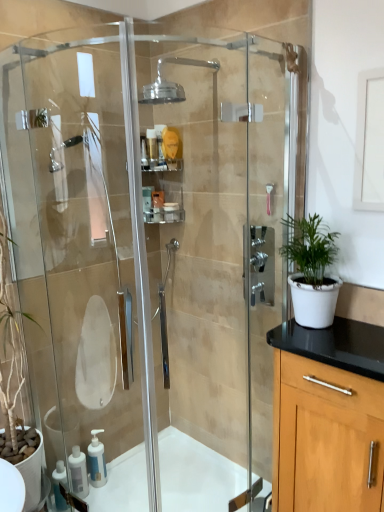
What do you see at coordinates (96, 460) in the screenshot? This screenshot has height=512, width=384. I see `white plastic soap dispenser at lower left, arranged as the second soap dispenser when viewed from the left` at bounding box center [96, 460].

Image resolution: width=384 pixels, height=512 pixels. I want to click on clear plastic container at center, the first toiletry in the top-to-bottom sequence, so click(144, 153).

This screenshot has width=384, height=512. I want to click on translucent plastic soap dispenser at lower left, which appears as the second soap dispenser when viewed from the right, so click(x=78, y=472).

Describe the element at coordinates (80, 234) in the screenshot. I see `transparent glass shower door at left` at that location.

Measure the distance between white matte pot at right and camera.

white matte pot at right and camera are 5.03 feet apart from each other.

Where is `clear plastic shelf at upper center`? Image resolution: width=384 pixels, height=512 pixels. clear plastic shelf at upper center is located at coordinates (163, 192).

How distant is transparent glass shower door at left from white plastic container at center, the 3th toiletry viewed from the top?

35.10 inches.

Which is farther from the camera, (107, 303) or (178, 204)?

→ The point (107, 303) is farther.

Can you tell me how much transparent glass shower door at left and white plastic container at center, the 3th toiletry viewed from the top, differ in facing direction?

The facing directions of transparent glass shower door at left and white plastic container at center, the 3th toiletry viewed from the top, are 88.2 degrees apart.

From a real-world perspective, which object rests below the other?

transparent glass shower door at left is physically lower.

Identify the location of shelf above the white glossy bath at lower left (from a real-world perspective). (163, 192).

Considering the relative positions of clear plastic shelf at upper center and white glossy bath at lower left in the image provided, is clear plastic shelf at upper center to the right of white glossy bath at lower left from the viewer's perspective?

No.

Measure the distance between clear plastic shelf at upper center and white glossy bath at lower left.

clear plastic shelf at upper center and white glossy bath at lower left are 1.50 meters apart from each other.

How different are the orientations of clear plastic shelf at upper center and white glossy bath at lower left in degrees?

There is a 0.978-degree angle between the facing directions of clear plastic shelf at upper center and white glossy bath at lower left.

From a real-world perspective, who is located higher, white matte pot at right or clear plastic container at center, the first toiletry in the top-to-bottom sequence?

Answer: clear plastic container at center, the first toiletry in the top-to-bottom sequence, is physically above.

Can you confirm if white matte pot at right is wider than clear plastic container at center, the 3th toiletry positioned from the bottom?

Yes.

Considering the sizes of white matte pot at right and clear plastic container at center, the 3th toiletry positioned from the bottom, in the image, is white matte pot at right bigger or smaller than clear plastic container at center, the 3th toiletry positioned from the bottom,?

Considering their sizes, white matte pot at right takes up more space than clear plastic container at center, the 3th toiletry positioned from the bottom.

Based on the photo, which is closer, (x=306, y=236) or (x=143, y=142)?

The point (x=143, y=142) is closer to the camera.

Can you tell me how much transparent glass shower door at left and white plastic soap dispenser at lower left, the first soap dispenser in the right-to-left sequence, differ in facing direction?

The angle between the facing direction of transparent glass shower door at left and the facing direction of white plastic soap dispenser at lower left, the first soap dispenser in the right-to-left sequence, is 89.5 degrees.

In the scene shown: Based on their sizes in the image, would you say transparent glass shower door at left is bigger or smaller than white plastic soap dispenser at lower left, the first soap dispenser in the right-to-left sequence?

transparent glass shower door at left is bigger than white plastic soap dispenser at lower left, the first soap dispenser in the right-to-left sequence.

Looking at this image, can you confirm if transparent glass shower door at left is thinner than white plastic soap dispenser at lower left, arranged as the second soap dispenser when viewed from the left?

In fact, transparent glass shower door at left might be wider than white plastic soap dispenser at lower left, arranged as the second soap dispenser when viewed from the left.

You are a GUI agent. You are given a task and a screenshot of the screen. Output one action in this format:
    pyautogui.click(x=<x>, y=<y>)
    Task: Click on the screen door above the white plastic soap dispenser at lower left, arranged as the second soap dispenser when viewed from the left (from the image's perspective)
    This screenshot has height=512, width=384.
    Given the screenshot: What is the action you would take?
    pyautogui.click(x=80, y=234)

Is transparent glass shower door at left facing towards matte plastic container at upper center, which is counted as the second toiletry, starting from the bottom?

No, transparent glass shower door at left is not oriented towards matte plastic container at upper center, which is counted as the second toiletry, starting from the bottom.

How much distance is there between transparent glass shower door at left and matte plastic container at upper center, positioned as the second toiletry in top-to-bottom order?

A distance of 36.56 inches exists between transparent glass shower door at left and matte plastic container at upper center, positioned as the second toiletry in top-to-bottom order.

Find the location of a particular element. the 2nd toiletry positioned above the transparent glass shower door at left (from the image's perspective) is located at coordinates pos(157,204).

Is transparent glass shower door at left placed right next to matte plastic container at upper center, positioned as the second toiletry in top-to-bottom order?

Result: transparent glass shower door at left and matte plastic container at upper center, positioned as the second toiletry in top-to-bottom order, are clearly separated.

Between white glossy bath at lower left and matte plastic container at upper center, positioned as the second toiletry in top-to-bottom order, which one is positioned in front?

white glossy bath at lower left.

Is white glossy bath at lower left directly adjacent to matte plastic container at upper center, positioned as the second toiletry in top-to-bottom order?

white glossy bath at lower left is not next to matte plastic container at upper center, positioned as the second toiletry in top-to-bottom order, and they're not touching.

Is white glossy bath at lower left wider or thinner than matte plastic container at upper center, positioned as the second toiletry in top-to-bottom order?

Clearly, white glossy bath at lower left has more width compared to matte plastic container at upper center, positioned as the second toiletry in top-to-bottom order.

Considering the positions of objects white glossy bath at lower left and matte plastic container at upper center, which is counted as the second toiletry, starting from the bottom, in the image provided, who is more to the left, white glossy bath at lower left or matte plastic container at upper center, which is counted as the second toiletry, starting from the bottom,?

matte plastic container at upper center, which is counted as the second toiletry, starting from the bottom, is more to the left.

In terms of size, does white plastic soap dispenser at lower left, the first soap dispenser in the right-to-left sequence, appear bigger or smaller than translucent plastic soap dispenser at lower left, acting as the 1th soap dispenser starting from the left?

Considering their sizes, white plastic soap dispenser at lower left, the first soap dispenser in the right-to-left sequence, takes up more space than translucent plastic soap dispenser at lower left, acting as the 1th soap dispenser starting from the left.

Would you consider white plastic soap dispenser at lower left, the first soap dispenser in the right-to-left sequence, to be distant from translucent plastic soap dispenser at lower left, which appears as the second soap dispenser when viewed from the right?

No, white plastic soap dispenser at lower left, the first soap dispenser in the right-to-left sequence, is not far away from translucent plastic soap dispenser at lower left, which appears as the second soap dispenser when viewed from the right.

What's the angular difference between white plastic soap dispenser at lower left, arranged as the second soap dispenser when viewed from the left, and translucent plastic soap dispenser at lower left, acting as the 1th soap dispenser starting from the left,'s facing directions?

They differ by 0.000271 degrees in their facing directions.

Considering the relative sizes of white plastic soap dispenser at lower left, arranged as the second soap dispenser when viewed from the left, and translucent plastic soap dispenser at lower left, acting as the 1th soap dispenser starting from the left, in the image provided, is white plastic soap dispenser at lower left, arranged as the second soap dispenser when viewed from the left, wider than translucent plastic soap dispenser at lower left, acting as the 1th soap dispenser starting from the left,?

No, white plastic soap dispenser at lower left, arranged as the second soap dispenser when viewed from the left, is not wider than translucent plastic soap dispenser at lower left, acting as the 1th soap dispenser starting from the left.

This screenshot has height=512, width=384. Find the location of `screen door located on the left of white plastic container at center, the 3th toiletry viewed from the top`. screen door located on the left of white plastic container at center, the 3th toiletry viewed from the top is located at coordinates (80, 234).

There is a white glossy bath at lower left. Identify the location of shelf above it (from a real-world perspective). (163, 192).

Estimate the real-world distances between objects in this image. Which object is further from transparent glass shower door at left, clear plastic shelf at upper center or clear glass shower head at upper center?

clear plastic shelf at upper center is positioned further to the anchor transparent glass shower door at left.

Consider the image. Looking at the image, which one is located further to white glossy bath at lower left, white plastic container at center, the 3th toiletry viewed from the top, or transparent glass shower door at left?

Among the two, white plastic container at center, the 3th toiletry viewed from the top, is located further to white glossy bath at lower left.

Looking at the image, which one is located further to white plastic container at center, marked as the 1th toiletry in a bottom-to-top arrangement, matte plastic container at upper center, which is counted as the second toiletry, starting from the bottom, or white matte pot at right?

white matte pot at right lies further to white plastic container at center, marked as the 1th toiletry in a bottom-to-top arrangement, than the other object.

Based on their spatial positions, is white plastic soap dispenser at lower left, the first soap dispenser in the right-to-left sequence, or white matte pot at right closer to matte plastic container at upper center, positioned as the second toiletry in top-to-bottom order?

white matte pot at right is closer to matte plastic container at upper center, positioned as the second toiletry in top-to-bottom order.

From the image, which object appears to be nearer to white glossy bath at lower left, white plastic soap dispenser at lower left, the first soap dispenser in the right-to-left sequence, or translucent plastic soap dispenser at lower left, which appears as the second soap dispenser when viewed from the right?

white plastic soap dispenser at lower left, the first soap dispenser in the right-to-left sequence, is positioned closer to the anchor white glossy bath at lower left.

Estimate the real-world distances between objects in this image. Which object is further from white matte pot at right, clear plastic container at center, the 3th toiletry positioned from the bottom, or matte plastic container at upper center, positioned as the second toiletry in top-to-bottom order?

clear plastic container at center, the 3th toiletry positioned from the bottom, is positioned further to the anchor white matte pot at right.

Looking at the image, which one is located closer to clear glass shower head at upper center, clear plastic container at center, the first toiletry in the top-to-bottom sequence, or translucent plastic soap dispenser at lower left, acting as the 1th soap dispenser starting from the left?

Based on the image, clear plastic container at center, the first toiletry in the top-to-bottom sequence, appears to be nearer to clear glass shower head at upper center.

Based on their spatial positions, is translucent plastic soap dispenser at lower left, which appears as the second soap dispenser when viewed from the right, or matte plastic container at upper center, which is counted as the second toiletry, starting from the bottom, closer to clear plastic shelf at upper center?

Based on the image, matte plastic container at upper center, which is counted as the second toiletry, starting from the bottom, appears to be nearer to clear plastic shelf at upper center.

Locate an element on the screen. Image resolution: width=384 pixels, height=512 pixels. shelf between clear glass shower head at upper center and white matte pot at right vertically is located at coordinates (163, 192).

This screenshot has height=512, width=384. What are the coordinates of `soap dispenser between clear plastic container at center, the 3th toiletry positioned from the bottom, and translucent plastic soap dispenser at lower left, which appears as the second soap dispenser when viewed from the right, vertically` in the screenshot? It's located at (96, 460).

Find the location of a particular element. The image size is (384, 512). shelf between clear glass shower head at upper center and transparent glass shower door at left in the up-down direction is located at coordinates (163, 192).

Identify the location of toiletry between matte plastic container at upper center, which is counted as the second toiletry, starting from the bottom, and white plastic soap dispenser at lower left, arranged as the second soap dispenser when viewed from the left, in the vertical direction. 171,211.